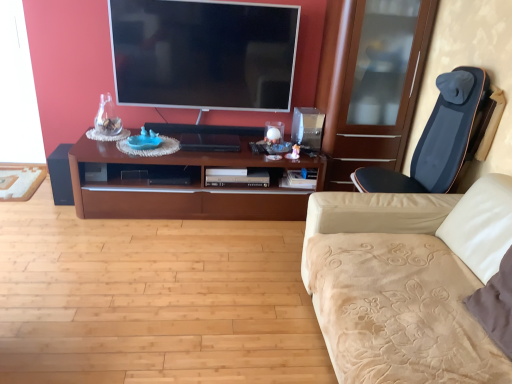
What is the approximate height of beige velvety studio couch at right?

beige velvety studio couch at right is 30.31 inches in height.

Where is `black matte speaker at left`? black matte speaker at left is located at coordinates (61, 175).

The height and width of the screenshot is (384, 512). What do you see at coordinates (204, 54) in the screenshot?
I see `flat screen tv at upper center` at bounding box center [204, 54].

I want to click on beige velvety studio couch at right, so pyautogui.click(x=407, y=282).

Could you tell me if flat screen tv at upper center is turned towards beige velvety studio couch at right?

Yes, flat screen tv at upper center is facing beige velvety studio couch at right.

Is flat screen tv at upper center closer to the viewer compared to beige velvety studio couch at right?

No, flat screen tv at upper center is further to the viewer.

Is flat screen tv at upper center at the right side of beige velvety studio couch at right?

No.

What's the angular difference between brown wood cabinet at center and flat screen tv at upper center's facing directions?

There is a 9.85e-05-degree angle between the facing directions of brown wood cabinet at center and flat screen tv at upper center.

From the picture: Between brown wood cabinet at center and flat screen tv at upper center, which one is positioned in front?

Positioned in front is brown wood cabinet at center.

Could flat screen tv at upper center be considered to be inside brown wood cabinet at center?

That's incorrect, flat screen tv at upper center is not inside brown wood cabinet at center.

Which is behind, point (106, 177) or point (134, 88)?

The point (134, 88) is farther from the camera.

Based on the photo, how different are the orientations of dark blue fabric massage chair at right and beige velvety studio couch at right in degrees?

The angle between the facing direction of dark blue fabric massage chair at right and the facing direction of beige velvety studio couch at right is 0.301 degrees.

Based on their sizes in the image, would you say dark blue fabric massage chair at right is bigger or smaller than beige velvety studio couch at right?

Clearly, dark blue fabric massage chair at right is smaller in size than beige velvety studio couch at right.

Which of these two, dark blue fabric massage chair at right or beige velvety studio couch at right, is thinner?

dark blue fabric massage chair at right is thinner.

Which is in front, point (66, 187) or point (414, 261)?

The point (414, 261) is more forward.

From the image's perspective, which one is positioned higher, black matte speaker at left or beige velvety studio couch at right?

black matte speaker at left appears higher in the image.

Which of these two, black matte speaker at left or beige velvety studio couch at right, is bigger?

With larger size is beige velvety studio couch at right.

Is brown wood cabinet at center positioned with its back to black matte speaker at left?

brown wood cabinet at center is not turned away from black matte speaker at left.

Is brown wood cabinet at center not near black matte speaker at left?

That's not correct — brown wood cabinet at center is a little close to black matte speaker at left.

Looking at their sizes, would you say brown wood cabinet at center is wider or thinner than black matte speaker at left?

Considering their sizes, brown wood cabinet at center looks broader than black matte speaker at left.

Is flat screen tv at upper center inside or outside of brown wood cabinet at center?

flat screen tv at upper center is outside brown wood cabinet at center.

Find the location of a particular element. The width and height of the screenshot is (512, 384). cabinetry located in front of the flat screen tv at upper center is located at coordinates (183, 185).

Would you consider flat screen tv at upper center to be distant from brown wood cabinet at center?

No, flat screen tv at upper center is in close proximity to brown wood cabinet at center.

Who is taller, flat screen tv at upper center or brown wood cabinet at center?

flat screen tv at upper center is taller.

Is flat screen tv at upper center facing towards dark blue fabric massage chair at right?

No, flat screen tv at upper center is not turned towards dark blue fabric massage chair at right.

Is flat screen tv at upper center closer to the viewer compared to dark blue fabric massage chair at right?

No, it is not.

At what (x,y) coordinates should I click in order to perform the action: click on television behind the dark blue fabric massage chair at right. Please return your answer as a coordinate pair (x, y). This screenshot has height=384, width=512. Looking at the image, I should click on (204, 54).

Find the location of a particular element. television lying behind the beige velvety studio couch at right is located at coordinates (204, 54).

At what (x,y) coordinates should I click in order to perform the action: click on cabinetry directly beneath the flat screen tv at upper center (from a real-world perspective). Please return your answer as a coordinate pair (x, y). The width and height of the screenshot is (512, 384). Looking at the image, I should click on (183, 185).

Estimate the real-world distances between objects in this image. Which object is closer to flat screen tv at upper center, black matte speaker at left or beige velvety studio couch at right?

black matte speaker at left is positioned closer to the anchor flat screen tv at upper center.

Based on the photo, considering their positions, is brown wood cabinet at center positioned further to dark blue fabric massage chair at right than black matte speaker at left?

black matte speaker at left is positioned further to the anchor dark blue fabric massage chair at right.

From the image, which object appears to be nearer to dark blue fabric massage chair at right, black matte speaker at left or brown wood cabinet at center?

brown wood cabinet at center is closer to dark blue fabric massage chair at right.

Considering their positions, is dark blue fabric massage chair at right positioned further to brown wood cabinet at center than flat screen tv at upper center?

Among the two, dark blue fabric massage chair at right is located further to brown wood cabinet at center.

Estimate the real-world distances between objects in this image. Which object is closer to dark blue fabric massage chair at right, black matte speaker at left or beige velvety studio couch at right?

The object closer to dark blue fabric massage chair at right is beige velvety studio couch at right.

From the image, which object appears to be nearer to black matte speaker at left, flat screen tv at upper center or brown wood cabinet at center?

brown wood cabinet at center lies closer to black matte speaker at left than the other object.

When comparing their distances from beige velvety studio couch at right, does dark blue fabric massage chair at right or brown wood cabinet at center seem closer?

Based on the image, dark blue fabric massage chair at right appears to be nearer to beige velvety studio couch at right.

From the image, which object appears to be farther from brown wood cabinet at center, dark blue fabric massage chair at right or beige velvety studio couch at right?

beige velvety studio couch at right.

Locate an element on the screen. The width and height of the screenshot is (512, 384). studio couch situated between black matte speaker at left and dark blue fabric massage chair at right from left to right is located at coordinates 407,282.

Identify the location of chair located between beige velvety studio couch at right and flat screen tv at upper center in the depth direction. This screenshot has height=384, width=512. (439, 138).

You are a GUI agent. You are given a task and a screenshot of the screen. Output one action in this format:
    pyautogui.click(x=<x>, y=<y>)
    Task: Click on the television located between beige velvety studio couch at right and black matte speaker at left in the depth direction
    
    Given the screenshot: What is the action you would take?
    pyautogui.click(x=204, y=54)

Where is `chair between beige velvety studio couch at right and brown wood cabinet at center in the front-back direction`? The height and width of the screenshot is (384, 512). chair between beige velvety studio couch at right and brown wood cabinet at center in the front-back direction is located at coordinates (439, 138).